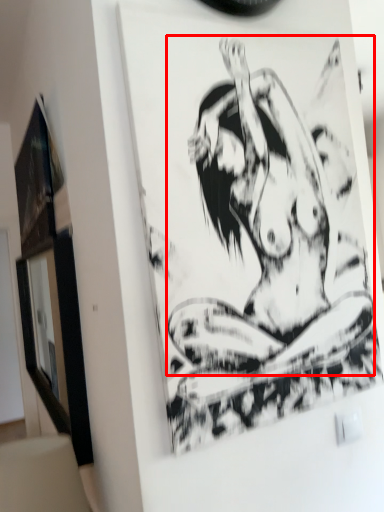
Question: From the image, what is the correct spatial relationship of person (annotated by the red box) in relation to picture frame?

Choices:
 (A) left
 (B) right

Answer: (B)